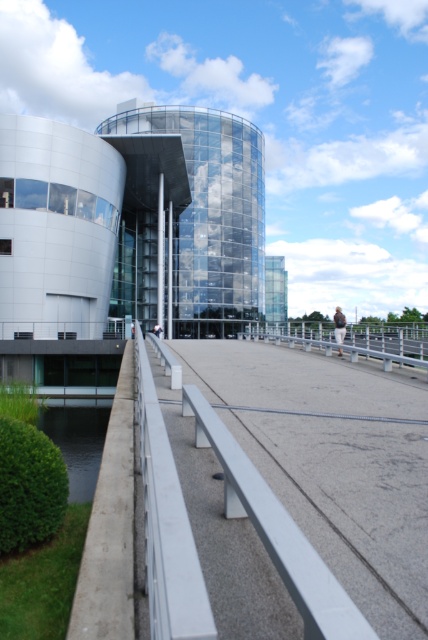
Between point (365, 381) and point (415, 358), which one is positioned behind?

The point (415, 358) is behind.

Can you confirm if smooth concrete path at center is wider than silver metallic rail at center?

Correct, the width of smooth concrete path at center exceeds that of silver metallic rail at center.

Between point (388, 525) and point (311, 333), which one is positioned in front?

Point (388, 525) is in front.

This screenshot has width=428, height=640. What are the coordinates of `smooth concrete path at center` in the screenshot? It's located at (333, 464).